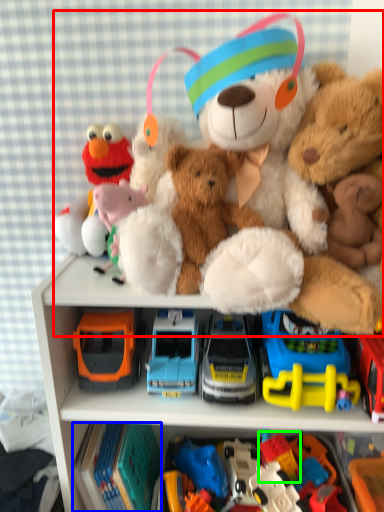
Question: Considering the real-world distances, which object is closest to teddy bear (highlighted by a red box)? toy (highlighted by a blue box) or toy (highlighted by a green box).

Choices:
 (A) toy
 (B) toy

Answer: (A)